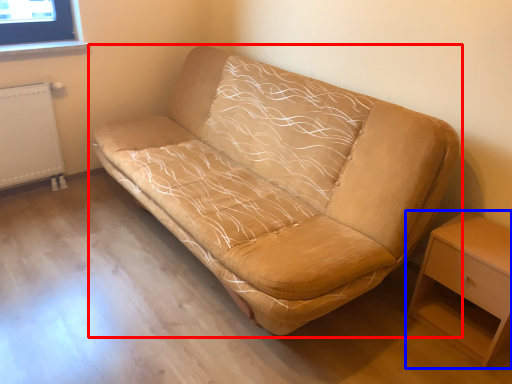
Question: Which point is further to the camera, studio couch (highlighted by a red box) or nightstand (highlighted by a blue box)?

Choices:
 (A) studio couch
 (B) nightstand

Answer: (B)